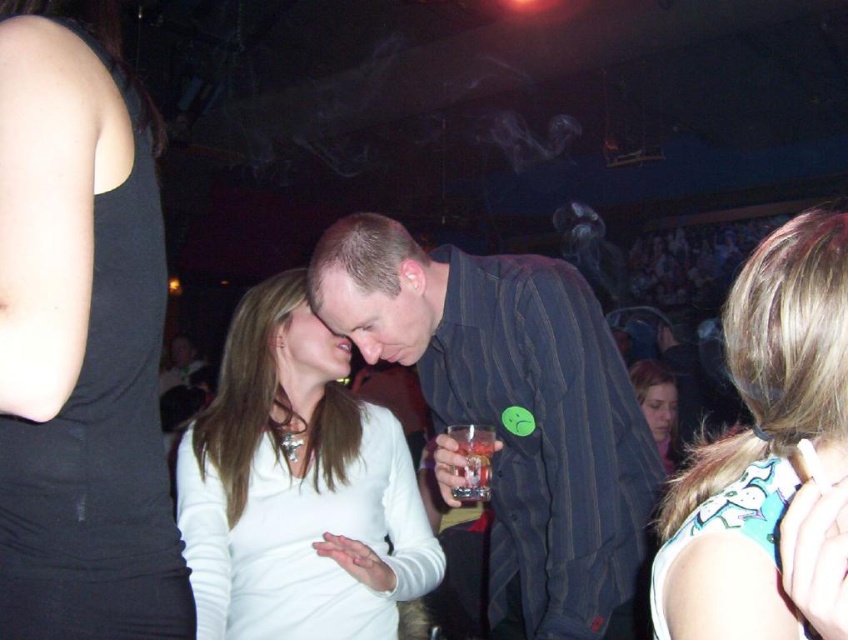
You are a security guard in the nightclub and need to locate the black matte tank top at upper left. According to the coordinates provided, where exactly is it positioned in the image?

The black matte tank top at upper left is positioned at point (x=81, y=339) in the image coordinates.

In the scene shown: You are a bartender at the bar. You see a striped fabric shirt at center and a translucent glass at center. Which object is closer to the right side of the bar?

The striped fabric shirt at center is closer to the right side of the bar because it is positioned to the right of the translucent glass at center.